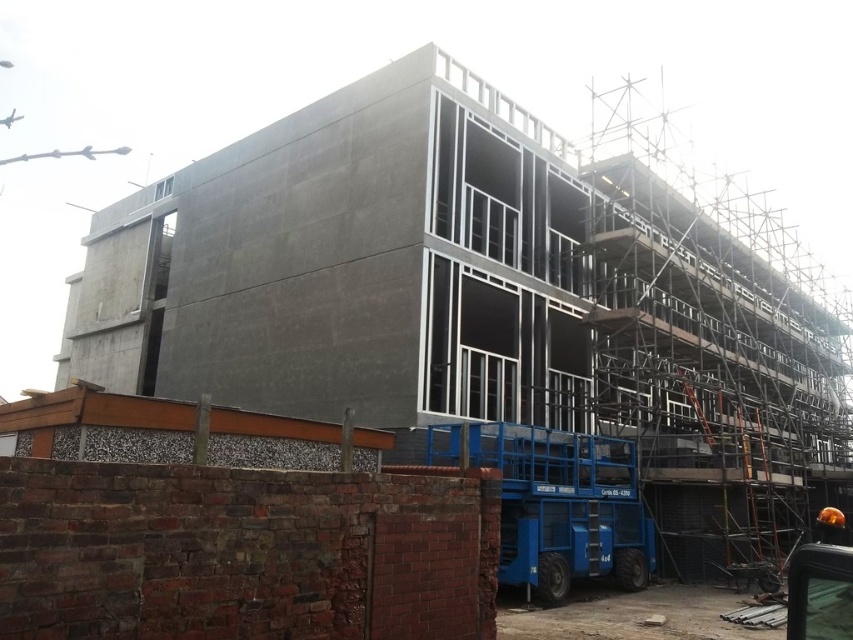
Question: Can you confirm if metallic scaffolding at right is positioned below shiny orange helmet at lower right?

Choices:
 (A) yes
 (B) no

Answer: (B)

Question: Is metallic scaffolding at right further to the viewer compared to shiny orange helmet at lower right?

Choices:
 (A) no
 (B) yes

Answer: (B)

Question: Among these points, which one is farthest from the camera?

Choices:
 (A) pyautogui.click(x=724, y=224)
 (B) pyautogui.click(x=845, y=531)

Answer: (A)

Question: Among these points, which one is farthest from the camera?

Choices:
 (A) (811, 532)
 (B) (691, 266)

Answer: (B)

Question: Is metallic scaffolding at right further to camera compared to shiny orange helmet at lower right?

Choices:
 (A) no
 (B) yes

Answer: (B)